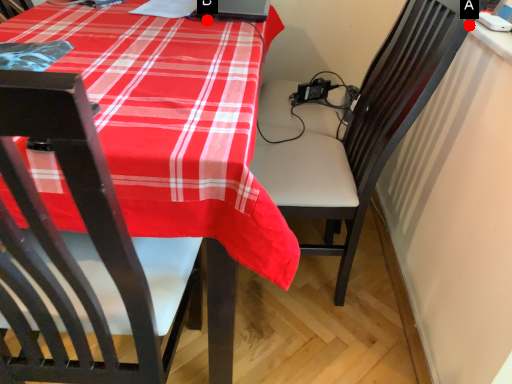
Question: Two points are circled on the image, labeled by A and B beside each circle. Which point is closer to the camera taking this photo?

Choices:
 (A) A is closer
 (B) B is closer

Answer: (A)